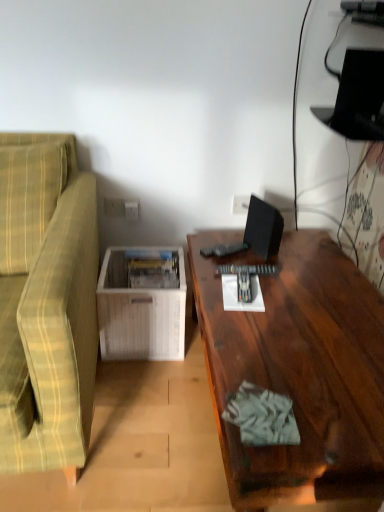
Identify the location of white plastic electric outlet at center, acting as the 2th electric outlet starting from the back. This screenshot has height=512, width=384. (131, 210).

The height and width of the screenshot is (512, 384). Describe the element at coordinates (46, 304) in the screenshot. I see `green plaid fabric couch at left` at that location.

Locate an element on the screen. dark wood desk at right is located at coordinates (299, 371).

Measure the distance from white wood magazine rack at lower left to green plaid fabric couch at left.

white wood magazine rack at lower left and green plaid fabric couch at left are 14.76 inches apart from each other.

From a real-world perspective, which object stands above the other?

green plaid fabric couch at left.

Which of these two, white wood magazine rack at lower left or green plaid fabric couch at left, is thinner?

With smaller width is white wood magazine rack at lower left.

Is white wood magazine rack at lower left to the right of green plaid fabric couch at left from the viewer's perspective?

Yes.

Locate an element on the screen. This screenshot has height=512, width=384. the 2nd electric outlet above when counting from the green plaid fabric couch at left (from the image's perspective) is located at coordinates (240, 204).

Would you say green plaid fabric couch at left is part of white plastic electric outlet at center, placed as the first electric outlet when sorted from right to left,'s contents?

No, green plaid fabric couch at left is not inside white plastic electric outlet at center, placed as the first electric outlet when sorted from right to left.

Considering the relative sizes of white plastic electric outlet at center, which is the 2th electric outlet from front to back, and green plaid fabric couch at left in the image provided, is white plastic electric outlet at center, which is the 2th electric outlet from front to back, shorter than green plaid fabric couch at left?

Yes.

From a real-world perspective, who is located higher, white plastic electric outlet at center, which is the 2th electric outlet from front to back, or green plaid fabric couch at left?

In real-world perspective, white plastic electric outlet at center, which is the 2th electric outlet from front to back, is above.

From a real-world perspective, is white plastic electric outlet at center, the 2th electric outlet viewed from the right, above or below white plastic electric outlet at center, placed as the first electric outlet when sorted from right to left?

In terms of real-world spatial position, white plastic electric outlet at center, the 2th electric outlet viewed from the right, is below white plastic electric outlet at center, placed as the first electric outlet when sorted from right to left.

Considering the relative sizes of white plastic electric outlet at center, marked as the first electric outlet in a front-to-back arrangement, and white plastic electric outlet at center, placed as the first electric outlet when sorted from back to front, in the image provided, is white plastic electric outlet at center, marked as the first electric outlet in a front-to-back arrangement, bigger than white plastic electric outlet at center, placed as the first electric outlet when sorted from back to front,?

Correct, white plastic electric outlet at center, marked as the first electric outlet in a front-to-back arrangement, is larger in size than white plastic electric outlet at center, placed as the first electric outlet when sorted from back to front.

Could you tell me if white plastic electric outlet at center, the 2th electric outlet viewed from the right, is facing white plastic electric outlet at center, placed as the first electric outlet when sorted from right to left?

No, white plastic electric outlet at center, the 2th electric outlet viewed from the right, is not aimed at white plastic electric outlet at center, placed as the first electric outlet when sorted from right to left.

Find the location of a particular element. Image resolution: width=384 pixels, height=512 pixels. electric outlet below the white plastic electric outlet at center, placed as the first electric outlet when sorted from right to left (from the image's perspective) is located at coordinates (131, 210).

Is black matte computer monitor at upper right closer to the viewer compared to green plaid fabric couch at left?

No, the depth of black matte computer monitor at upper right is greater than that of green plaid fabric couch at left.

From the image's perspective, is black matte computer monitor at upper right located above green plaid fabric couch at left?

Yes.

Who is bigger, black matte computer monitor at upper right or green plaid fabric couch at left?

With larger size is green plaid fabric couch at left.

Is there a large distance between black matte computer monitor at upper right and green plaid fabric couch at left?

That's not correct — black matte computer monitor at upper right is a little close to green plaid fabric couch at left.

Could you tell me if white plastic electric outlet at center, which ranks as the 1th electric outlet in left-to-right order, is facing green plaid fabric couch at left?

No.

From the picture: Is white plastic electric outlet at center, marked as the first electric outlet in a front-to-back arrangement, positioned far away from green plaid fabric couch at left?

No.

Can you confirm if white plastic electric outlet at center, which ranks as the 1th electric outlet in left-to-right order, is taller than green plaid fabric couch at left?

No.

From a real-world perspective, does white plastic electric outlet at center, marked as the first electric outlet in a front-to-back arrangement, stand above green plaid fabric couch at left?

Yes, from a real-world perspective, white plastic electric outlet at center, marked as the first electric outlet in a front-to-back arrangement, is on top of green plaid fabric couch at left.

Is white plastic electric outlet at center, marked as the first electric outlet in a front-to-back arrangement, facing away from white wood magazine rack at lower left?

No, white plastic electric outlet at center, marked as the first electric outlet in a front-to-back arrangement, is not facing the opposite direction of white wood magazine rack at lower left.

Is there a large distance between white plastic electric outlet at center, the 2th electric outlet viewed from the right, and white wood magazine rack at lower left?

No, white plastic electric outlet at center, the 2th electric outlet viewed from the right, is in close proximity to white wood magazine rack at lower left.

From the image's perspective, is white plastic electric outlet at center, acting as the 2th electric outlet starting from the back, located above or below white wood magazine rack at lower left?

Clearly, from the image's perspective, white plastic electric outlet at center, acting as the 2th electric outlet starting from the back, is above white wood magazine rack at lower left.

Is black matte computer monitor at upper right inside the boundaries of white plastic electric outlet at center, marked as the first electric outlet in a front-to-back arrangement, or outside?

black matte computer monitor at upper right lies outside white plastic electric outlet at center, marked as the first electric outlet in a front-to-back arrangement.

Can you tell me how much black matte computer monitor at upper right and white plastic electric outlet at center, which ranks as the 1th electric outlet in left-to-right order, differ in facing direction?

The facing directions of black matte computer monitor at upper right and white plastic electric outlet at center, which ranks as the 1th electric outlet in left-to-right order, are 67.5 degrees apart.

In the scene shown: From the image's perspective, is black matte computer monitor at upper right above white plastic electric outlet at center, marked as the first electric outlet in a front-to-back arrangement?

No, from the image's perspective, black matte computer monitor at upper right is not on top of white plastic electric outlet at center, marked as the first electric outlet in a front-to-back arrangement.

There is a white wood magazine rack at lower left. Where is `studio couch above it (from a real-world perspective)`? This screenshot has width=384, height=512. studio couch above it (from a real-world perspective) is located at coordinates (46, 304).

At what (x,y) coordinates should I click in order to perform the action: click on studio couch lying below the white plastic electric outlet at center, which is the 2th electric outlet from front to back (from the image's perspective). Please return your answer as a coordinate pair (x, y). Image resolution: width=384 pixels, height=512 pixels. Looking at the image, I should click on (46, 304).

Estimate the real-world distances between objects in this image. Which object is further from white plastic electric outlet at center, the second electric outlet positioned from the left, black matte computer monitor at upper right or white wood magazine rack at lower left?

Based on the image, white wood magazine rack at lower left appears to be further to white plastic electric outlet at center, the second electric outlet positioned from the left.

Based on their spatial positions, is white plastic electric outlet at center, marked as the first electric outlet in a front-to-back arrangement, or black matte computer monitor at upper right closer to white wood magazine rack at lower left?

white plastic electric outlet at center, marked as the first electric outlet in a front-to-back arrangement.

Estimate the real-world distances between objects in this image. Which object is closer to white plastic electric outlet at center, acting as the 2th electric outlet starting from the back, white plastic electric outlet at center, placed as the first electric outlet when sorted from right to left, or white wood magazine rack at lower left?

white wood magazine rack at lower left.

Based on their spatial positions, is black matte computer monitor at upper right or dark wood desk at right further from white wood magazine rack at lower left?

black matte computer monitor at upper right.

Which object lies nearer to the anchor point black matte computer monitor at upper right, green plaid fabric couch at left or white plastic electric outlet at center, the 2th electric outlet viewed from the right?

Based on the image, white plastic electric outlet at center, the 2th electric outlet viewed from the right, appears to be nearer to black matte computer monitor at upper right.

Estimate the real-world distances between objects in this image. Which object is further from white plastic electric outlet at center, marked as the first electric outlet in a front-to-back arrangement, green plaid fabric couch at left or white wood magazine rack at lower left?

green plaid fabric couch at left lies further to white plastic electric outlet at center, marked as the first electric outlet in a front-to-back arrangement, than the other object.

Considering their positions, is dark wood desk at right positioned further to white plastic electric outlet at center, the 2th electric outlet viewed from the right, than green plaid fabric couch at left?

dark wood desk at right.

Which object lies nearer to the anchor point green plaid fabric couch at left, black matte computer monitor at upper right or white wood magazine rack at lower left?

Among the two, white wood magazine rack at lower left is located nearer to green plaid fabric couch at left.

Where is `computer monitor positioned between dark wood desk at right and white plastic electric outlet at center, the 2th electric outlet viewed from the right, from near to far`? The height and width of the screenshot is (512, 384). computer monitor positioned between dark wood desk at right and white plastic electric outlet at center, the 2th electric outlet viewed from the right, from near to far is located at coordinates (263, 228).

Image resolution: width=384 pixels, height=512 pixels. Find the location of `computer monitor between green plaid fabric couch at left and white plastic electric outlet at center, acting as the 2th electric outlet starting from the back, along the z-axis`. computer monitor between green plaid fabric couch at left and white plastic electric outlet at center, acting as the 2th electric outlet starting from the back, along the z-axis is located at coordinates (263, 228).

The image size is (384, 512). Identify the location of table between green plaid fabric couch at left and white plastic electric outlet at center, placed as the first electric outlet when sorted from back to front, along the z-axis. (142, 303).

Locate an element on the screen. The height and width of the screenshot is (512, 384). table between dark wood desk at right and white plastic electric outlet at center, placed as the first electric outlet when sorted from back to front, from front to back is located at coordinates (142, 303).